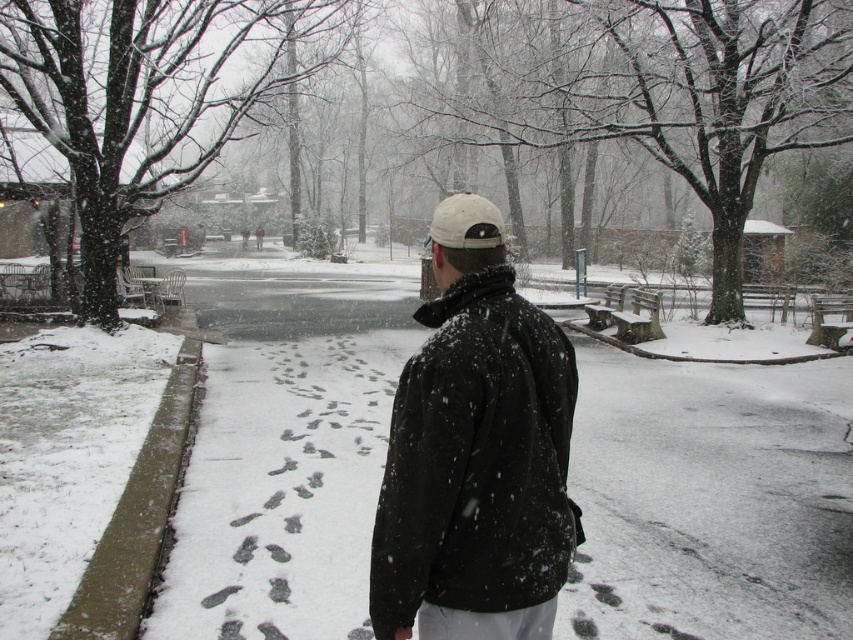
You are a photographer trying to capture the person in the scene. Since the black matte jacket at center and the white matte baseball hat at center are both at the center, which one should you focus on to ensure the subject is in focus?

The black matte jacket at center is in front of the white matte baseball hat at center, so focusing on the black matte jacket at center will ensure the subject is in focus.

You are standing at the origin point in the snowy park scene. The black matte jacket at center is at coordinates 0.727 on the x and 0.559 on the y. If you want to walk directly to the jacket, which direction should you move in terms of x and y coordinates?

To reach the black matte jacket at center located at coordinates x 0.727 and y 0.559, you should move in the positive x and positive y direction since both coordinates are greater than the origin point.